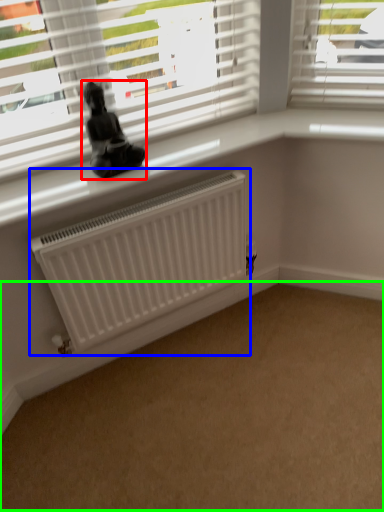
Question: Which object is the farthest from miniature (highlighted by a red box)? Choose among these: radiator (highlighted by a blue box) or plain (highlighted by a green box).

Choices:
 (A) radiator
 (B) plain

Answer: (B)